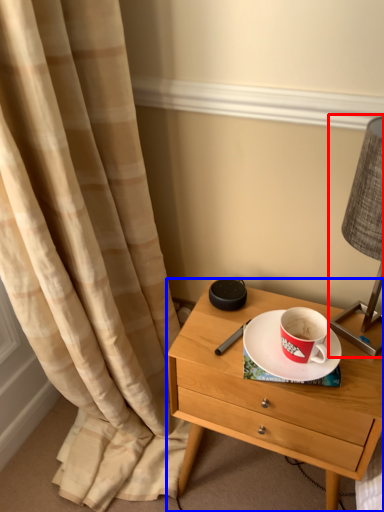
Question: Which object is closer to the camera taking this photo, bedside lamp (highlighted by a red box) or nightstand (highlighted by a blue box)?

Choices:
 (A) bedside lamp
 (B) nightstand

Answer: (A)